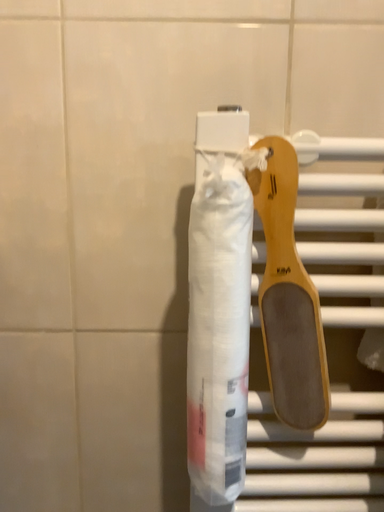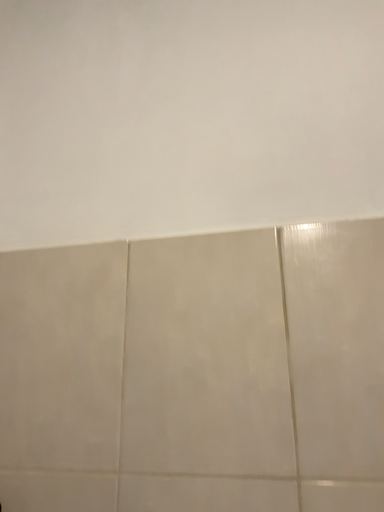
Question: Which way did the camera rotate in the video?

Choices:
 (A) rotated right
 (B) rotated left

Answer: (B)